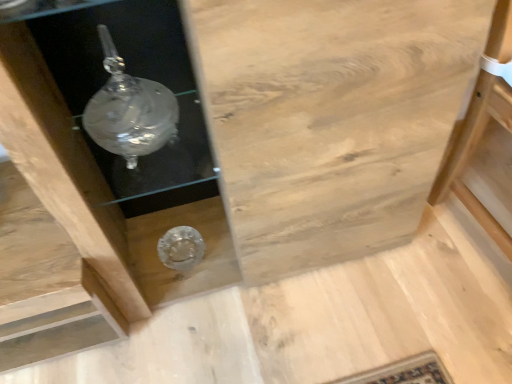
You are a GUI agent. You are given a task and a screenshot of the screen. Output one action in this format:
    pyautogui.click(x=<x>, y=<y>)
    Task: Click on the natural wood cabinet at center
    
    Given the screenshot: What is the action you would take?
    pyautogui.click(x=330, y=119)

What do you see at coordinates (330, 119) in the screenshot? I see `natural wood cabinet at center` at bounding box center [330, 119].

What is the approximate width of natural wood table at right?

17.83 inches.

Describe the element at coordinates (485, 141) in the screenshot. This screenshot has height=384, width=512. I see `natural wood table at right` at that location.

This screenshot has width=512, height=384. In order to click on natural wood table at right in this screenshot , I will do `click(485, 141)`.

Where is `natural wood cabinet at center`? The height and width of the screenshot is (384, 512). natural wood cabinet at center is located at coordinates (330, 119).

From the picture: Can you confirm if natural wood cabinet at center is positioned to the left of natural wood table at right?

Correct, you'll find natural wood cabinet at center to the left of natural wood table at right.

Is natural wood cabinet at center behind natural wood table at right?

That is False.

Considering the positions of points (297, 153) and (445, 169), is point (297, 153) closer to camera compared to point (445, 169)?

Yes, point (297, 153) is in front of point (445, 169).

From the image's perspective, between natural wood cabinet at center and natural wood table at right, who is located below?

natural wood table at right.

From a real-world perspective, is natural wood cabinet at center located beneath natural wood table at right?

No.

Is natural wood cabinet at center thinner than natural wood table at right?

Yes.

Who is taller, natural wood cabinet at center or natural wood table at right?

natural wood cabinet at center.

Does natural wood cabinet at center have a larger size compared to natural wood table at right?

Correct, natural wood cabinet at center is larger in size than natural wood table at right.

Could natural wood table at right be considered to be inside natural wood cabinet at center?

Definitely not — natural wood table at right is not inside natural wood cabinet at center.

Is natural wood cabinet at center next to natural wood table at right?

No, natural wood cabinet at center is not touching natural wood table at right.

Is natural wood cabinet at center oriented towards natural wood table at right?

No, natural wood cabinet at center is not facing towards natural wood table at right.

How many degrees apart are the facing directions of natural wood cabinet at center and natural wood table at right?

They differ by 7.53 degrees in their facing directions.

The width and height of the screenshot is (512, 384). In order to click on cabinetry lying above the natural wood table at right (from the image's perspective) in this screenshot , I will do `click(330, 119)`.

Which object is positioned more to the right, natural wood table at right or natural wood cabinet at center?

From the viewer's perspective, natural wood table at right appears more on the right side.

Is natural wood table at right closer to camera compared to natural wood cabinet at center?

No.

Which point is more forward, (462, 167) or (343, 169)?

The point (343, 169) is closer.

From the image's perspective, is natural wood table at right above or below natural wood cabinet at center?

natural wood table at right is situated lower than natural wood cabinet at center in the image.

From a real-world perspective, between natural wood table at right and natural wood cabinet at center, who is vertically higher?

natural wood cabinet at center, from a real-world perspective.

Considering the sizes of objects natural wood table at right and natural wood cabinet at center in the image provided, who is wider, natural wood table at right or natural wood cabinet at center?

natural wood table at right is wider.

Considering the relative sizes of natural wood table at right and natural wood cabinet at center in the image provided, is natural wood table at right shorter than natural wood cabinet at center?

Indeed, natural wood table at right has a lesser height compared to natural wood cabinet at center.

Is natural wood table at right smaller than natural wood cabinet at center?

Yes, natural wood table at right is smaller than natural wood cabinet at center.

Would you say natural wood table at right is outside natural wood cabinet at center?

Yes, natural wood table at right is outside of natural wood cabinet at center.

Does natural wood table at right touch natural wood cabinet at center?

No, natural wood table at right is not next to natural wood cabinet at center.

Based on the photo, is natural wood table at right facing away from natural wood cabinet at center?

That's not correct — natural wood table at right is not looking away from natural wood cabinet at center.

Measure the distance from natural wood table at right to natural wood cabinet at center.

13.01 inches.

This screenshot has height=384, width=512. Identify the location of cabinetry on the left of natural wood table at right. (330, 119).

The image size is (512, 384). I want to click on cabinetry located above the natural wood table at right (from a real-world perspective), so click(x=330, y=119).

Locate an element on the screen. Image resolution: width=512 pixels, height=384 pixels. cabinetry to the left of natural wood table at right is located at coordinates (330, 119).